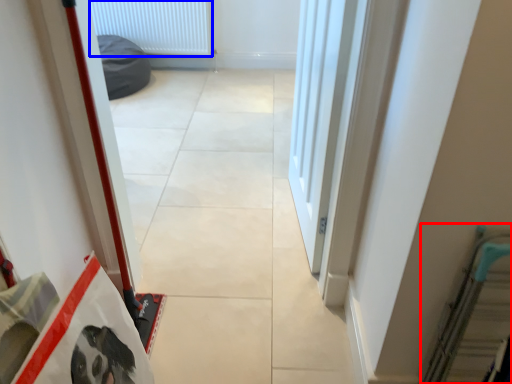
Question: Which of the following is the farthest to the observer, escalator (highlighted by a red box) or radiator (highlighted by a blue box)?

Choices:
 (A) escalator
 (B) radiator

Answer: (B)